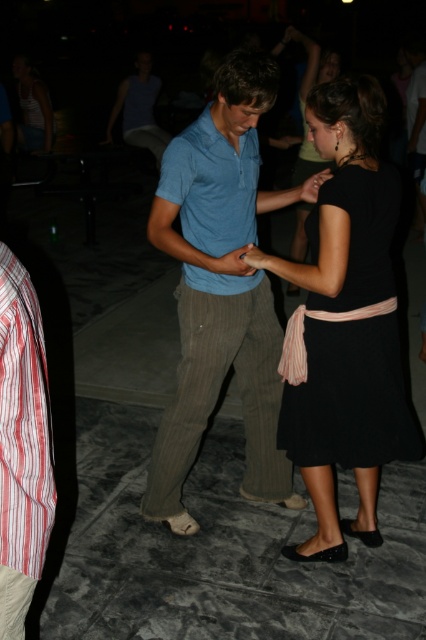
Question: Among these points, which one is farthest from the camera?

Choices:
 (A) (393, 394)
 (B) (9, 577)
 (C) (255, 208)
 (D) (181, 464)

Answer: (D)

Question: Does black satin dress at center appear on the right side of khaki pants at lower left?

Choices:
 (A) yes
 (B) no

Answer: (A)

Question: Which object is positioned farthest from the khaki pants at lower left?

Choices:
 (A) matte blue polo shirt at center
 (B) blue cotton shirt at center

Answer: (B)

Question: Considering the real-world distances, which object is closest to the black satin dress at center?

Choices:
 (A) matte blue polo shirt at center
 (B) blue cotton shirt at center
 (C) khaki pants at lower left

Answer: (B)

Question: Is blue cotton shirt at center wider than khaki pants at lower left?

Choices:
 (A) yes
 (B) no

Answer: (A)

Question: Is black satin dress at center to the left of khaki pants at lower left from the viewer's perspective?

Choices:
 (A) yes
 (B) no

Answer: (B)